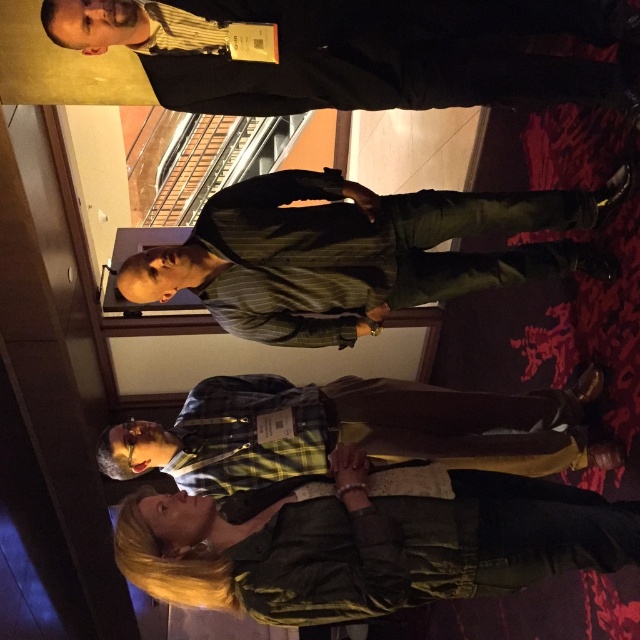
Question: Can you confirm if dark gray suit at upper center is smaller than green striped shirt at center?

Choices:
 (A) yes
 (B) no

Answer: (A)

Question: Estimate the real-world distances between objects in this image. Which object is farther from the green striped shirt at center?

Choices:
 (A) dark gray suit at upper center
 (B) green textured jacket at lower center

Answer: (B)

Question: Among these points, which one is nearest to the camera?

Choices:
 (A) (285, 289)
 (B) (488, 424)
 (C) (145, 518)
 (D) (61, 12)

Answer: (C)

Question: Which point is closer to the camera?

Choices:
 (A) (332, 381)
 (B) (417, 275)

Answer: (B)

Question: Does dark gray suit at upper center appear under green striped shirt at center?

Choices:
 (A) yes
 (B) no

Answer: (B)

Question: Is green striped shirt at center smaller than yellow plaid shirt at center?

Choices:
 (A) no
 (B) yes

Answer: (B)